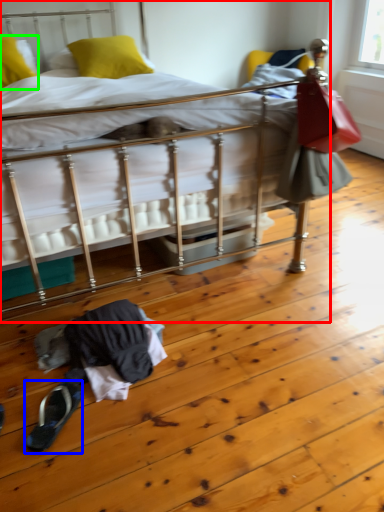
Question: Which is farther away from bed (highlighted by a red box)? footwear (highlighted by a blue box) or pillow (highlighted by a green box)?

Choices:
 (A) footwear
 (B) pillow

Answer: (A)